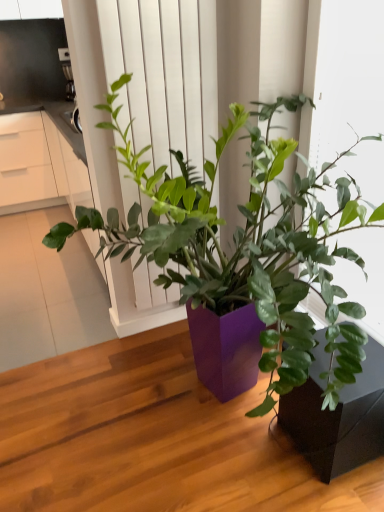
You are a GUI agent. You are given a task and a screenshot of the screen. Output one action in this format:
    pyautogui.click(x=<x>, y=<y>)
    Task: Click on the free point below purple matte planter at center (from a real-world perspective)
    Image resolution: width=384 pixels, height=512 pixels.
    Given the screenshot: What is the action you would take?
    pyautogui.click(x=196, y=433)